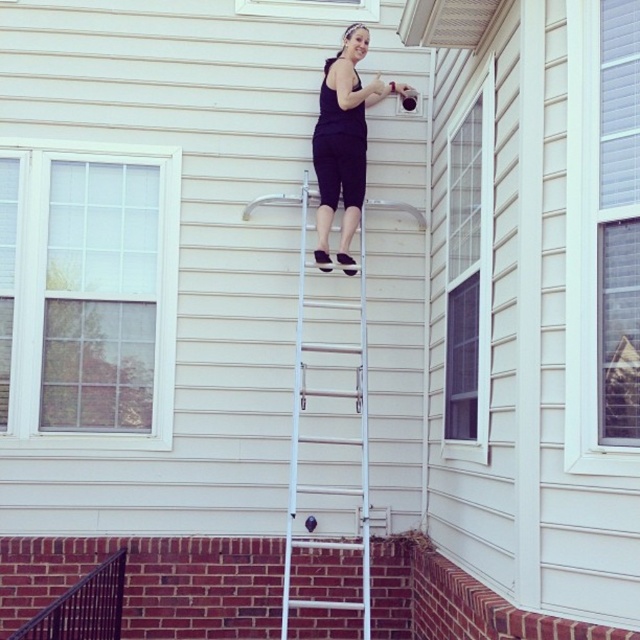
Does point (323, 541) come farther from viewer compared to point (108, 611)?

Yes, it is behind point (108, 611).

Which is behind, point (362, 456) or point (93, 632)?

Point (362, 456)

Identify the location of white metallic ladder at center. (317, 426).

The width and height of the screenshot is (640, 640). Describe the element at coordinates (342, 140) in the screenshot. I see `black matte pants at upper center` at that location.

Is black matte pants at upper center behind black metal/rail at lower left?

Yes.

You are a GUI agent. You are given a task and a screenshot of the screen. Output one action in this format:
    pyautogui.click(x=<x>, y=<y>)
    Task: Click on the black matte pants at upper center
    
    Given the screenshot: What is the action you would take?
    342,140

Locate an element on the screen. The height and width of the screenshot is (640, 640). black matte pants at upper center is located at coordinates (342, 140).

Does white metallic ladder at center have a lesser width compared to black matte pants at upper center?

Correct, white metallic ladder at center's width is less than black matte pants at upper center's.

At what (x,y) coordinates should I click in order to perform the action: click on white metallic ladder at center. Please return your answer as a coordinate pair (x, y). Looking at the image, I should click on (317, 426).